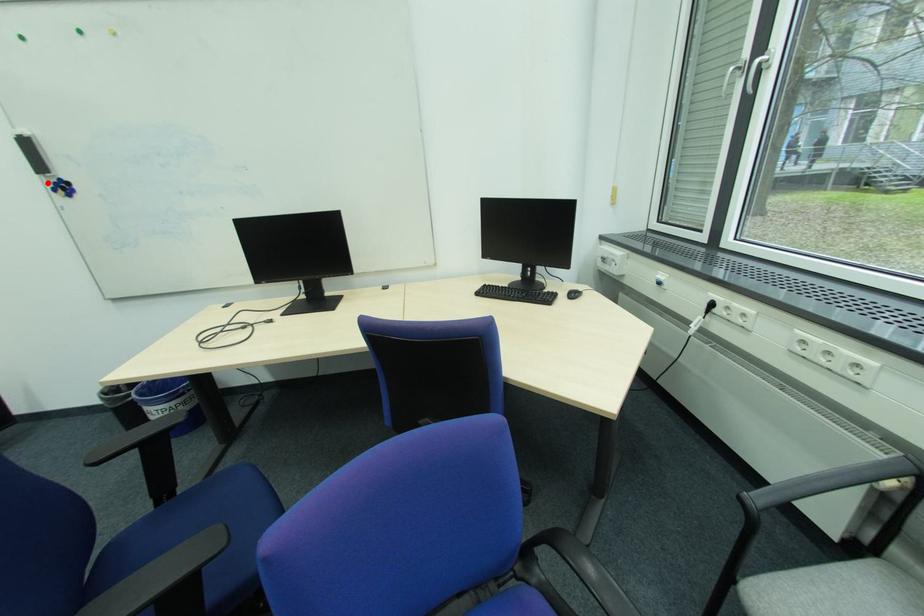
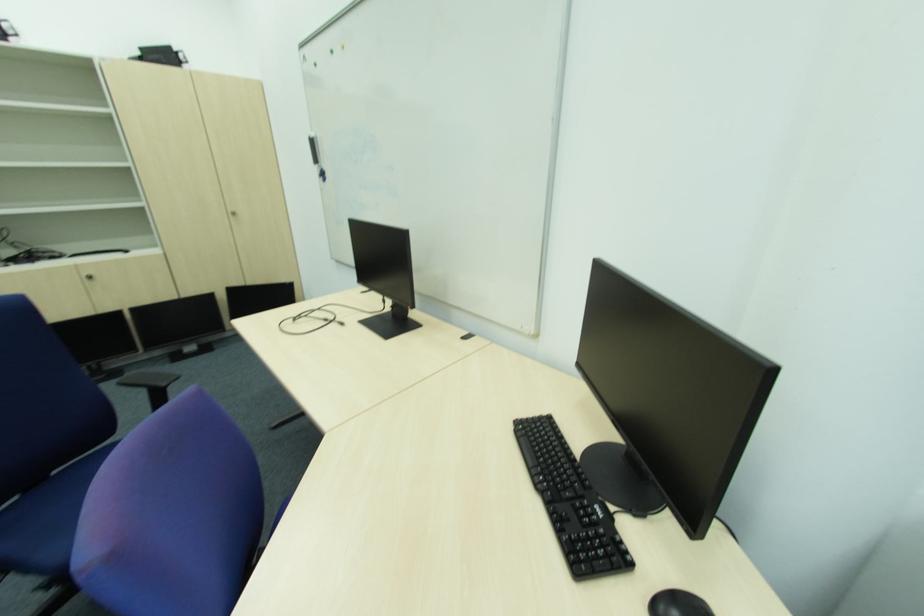
Find the pixel in the second image that matches the highlighted location in the first image.

(322, 172)